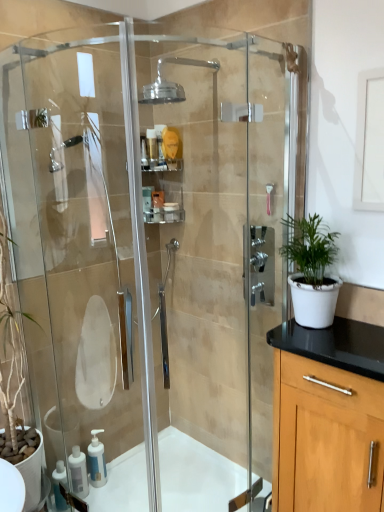
Question: Is white plastic container at center, the 3th toiletry viewed from the top, completely or partially outside of white matte pot at right?

Choices:
 (A) no
 (B) yes

Answer: (B)

Question: Does white plastic container at center, the 3th toiletry viewed from the top, have a lesser height compared to white matte pot at right?

Choices:
 (A) no
 (B) yes

Answer: (B)

Question: Can you confirm if white plastic container at center, marked as the 1th toiletry in a bottom-to-top arrangement, is smaller than white matte pot at right?

Choices:
 (A) no
 (B) yes

Answer: (B)

Question: Is the depth of white plastic container at center, the 3th toiletry viewed from the top, less than that of white matte pot at right?

Choices:
 (A) no
 (B) yes

Answer: (A)

Question: From a real-world perspective, is white plastic container at center, marked as the 1th toiletry in a bottom-to-top arrangement, beneath white matte pot at right?

Choices:
 (A) no
 (B) yes

Answer: (A)

Question: Can you confirm if white plastic container at center, the 3th toiletry viewed from the top, is taller than white matte pot at right?

Choices:
 (A) no
 (B) yes

Answer: (A)

Question: Does clear plastic shelf at upper center have a lesser width compared to white plastic container at center, the 3th toiletry viewed from the top?

Choices:
 (A) no
 (B) yes

Answer: (A)

Question: Considering the relative sizes of clear plastic shelf at upper center and white plastic container at center, marked as the 1th toiletry in a bottom-to-top arrangement, in the image provided, is clear plastic shelf at upper center smaller than white plastic container at center, marked as the 1th toiletry in a bottom-to-top arrangement,?

Choices:
 (A) no
 (B) yes

Answer: (A)

Question: Is there a large distance between clear plastic shelf at upper center and white plastic container at center, the 3th toiletry viewed from the top?

Choices:
 (A) no
 (B) yes

Answer: (A)

Question: Is clear plastic shelf at upper center facing away from white plastic container at center, the 3th toiletry viewed from the top?

Choices:
 (A) yes
 (B) no

Answer: (B)

Question: Is white plastic container at center, marked as the 1th toiletry in a bottom-to-top arrangement, inside clear plastic shelf at upper center?

Choices:
 (A) yes
 (B) no

Answer: (A)

Question: Does clear plastic shelf at upper center have a lesser height compared to white plastic container at center, the 3th toiletry viewed from the top?

Choices:
 (A) yes
 (B) no

Answer: (B)

Question: Is clear plastic shelf at upper center positioned with its back to white matte pot at right?

Choices:
 (A) yes
 (B) no

Answer: (B)